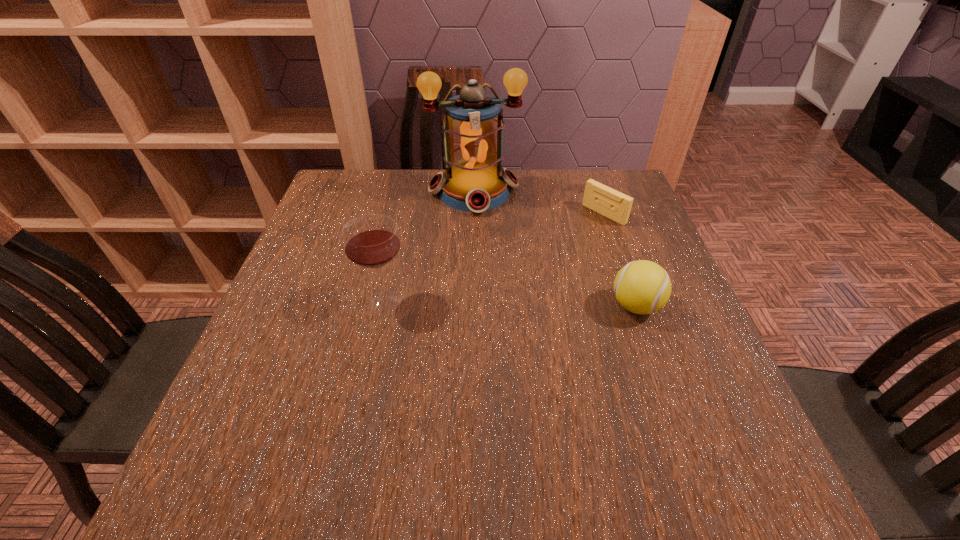
In order to click on vacant point located between the tennis ball and the wineglass in this screenshot , I will do `click(510, 303)`.

Image resolution: width=960 pixels, height=540 pixels. I want to click on unoccupied area between the wineglass and the tennis ball, so click(x=510, y=303).

This screenshot has width=960, height=540. What are the coordinates of `vacant area that lies between the leftmost object and the tennis ball` in the screenshot? It's located at (510, 303).

Identify the location of vacant area between the third tallest object and the shortest object. The width and height of the screenshot is (960, 540). (620, 260).

At what (x,y) coordinates should I click in order to perform the action: click on free space between the shortest object and the wineglass. Please return your answer as a coordinate pair (x, y). This screenshot has width=960, height=540. Looking at the image, I should click on (494, 257).

You are a GUI agent. You are given a task and a screenshot of the screen. Output one action in this format:
    pyautogui.click(x=<x>, y=<y>)
    Task: Click on the vacant area that lies between the tennis ball and the shortest object
    
    Given the screenshot: What is the action you would take?
    pos(620,260)

Locate an element on the screen. object that is the third closest one to the tennis ball is located at coordinates (371, 241).

This screenshot has width=960, height=540. In order to click on the second closest object to the third tallest object in this screenshot , I will do `click(474, 180)`.

I want to click on vacant region that satisfies the following two spatial constraints: 1. on the back side of the shortest object; 2. on the left side of the third tallest object, so click(x=603, y=214).

Where is `blank area in the image that satisfies the following two spatial constraints: 1. on the back side of the wineglass; 2. on the right side of the tallest object`? The image size is (960, 540). blank area in the image that satisfies the following two spatial constraints: 1. on the back side of the wineglass; 2. on the right side of the tallest object is located at coordinates (408, 191).